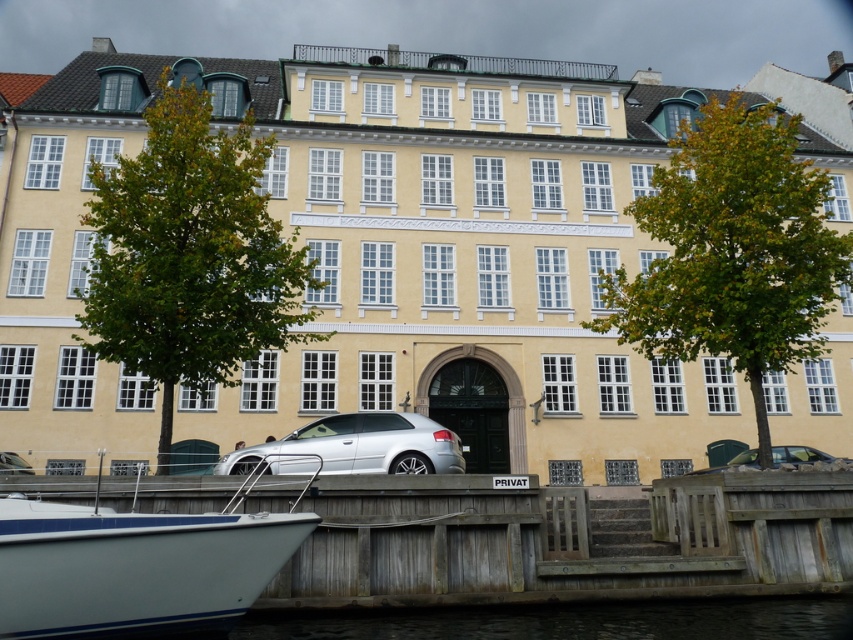
Find the location of `wooden dock at lower center`. wooden dock at lower center is located at coordinates (563, 540).

Consider the image. Does wooden dock at lower center have a larger size compared to silver metallic hatchback at center?

Correct, wooden dock at lower center is larger in size than silver metallic hatchback at center.

Identify the location of wooden dock at lower center. This screenshot has height=640, width=853. (563, 540).

Between white glossy boat at lower left and silver metallic car at lower center, which one has less height?

Standing shorter between the two is silver metallic car at lower center.

Who is taller, white glossy boat at lower left or silver metallic car at lower center?

With more height is white glossy boat at lower left.

What do you see at coordinates (135, 566) in the screenshot? I see `white glossy boat at lower left` at bounding box center [135, 566].

I want to click on white glossy boat at lower left, so click(x=135, y=566).

Locate an element on the screen. wooden dock at lower center is located at coordinates (563, 540).

Is point (334, 516) less distant than point (265, 561)?

No, (334, 516) is behind (265, 561).

The image size is (853, 640). I want to click on wooden dock at lower center, so pos(563,540).